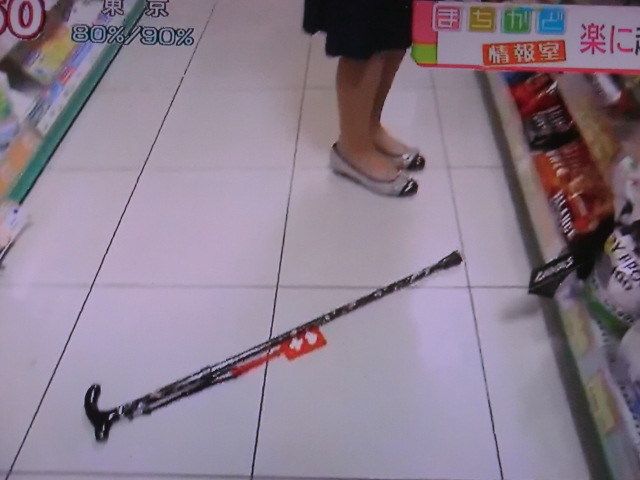
Image resolution: width=640 pixels, height=480 pixels. In order to click on tile floor in this screenshot , I will do (x=177, y=321).